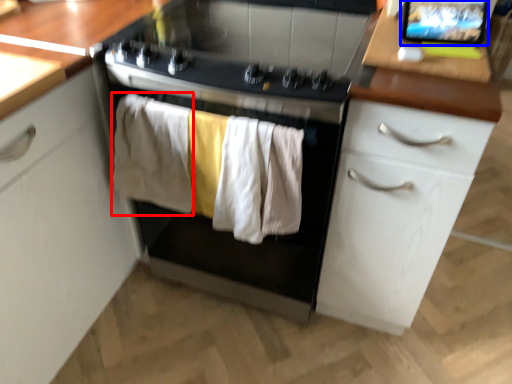
Question: Which object appears closest to the camera in this image, clothing (highlighted by a red box) or computer screen (highlighted by a blue box)?

Choices:
 (A) clothing
 (B) computer screen

Answer: (B)